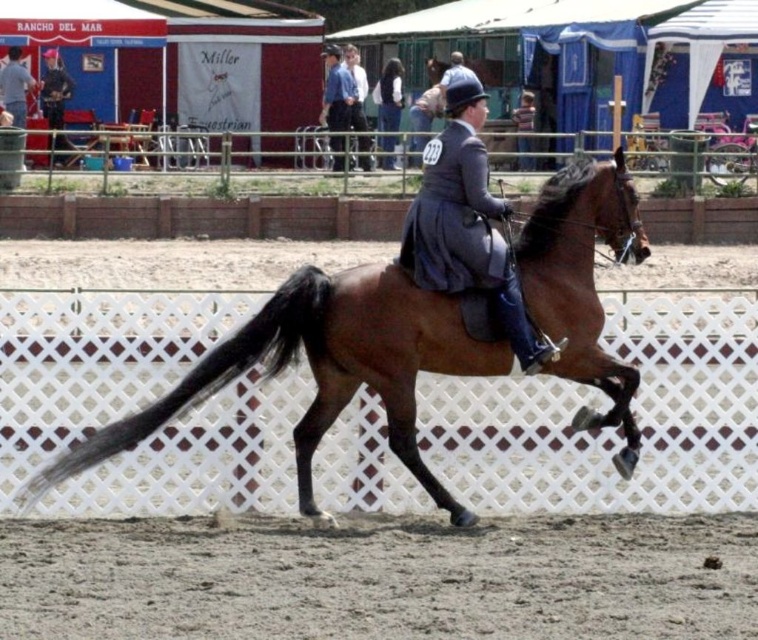
Question: Is matte gray suit at center smaller than blue cotton shirt at upper center?

Choices:
 (A) yes
 (B) no

Answer: (A)

Question: Which point appears closest to the camera in this image?

Choices:
 (A) (381, 124)
 (B) (448, 90)
 (C) (412, 444)

Answer: (C)

Question: Can you confirm if brown sandy dirt at lower center is bigger than brown glossy horse at center?

Choices:
 (A) no
 (B) yes

Answer: (A)

Question: Estimate the real-world distances between objects in this image. Which object is closer to the matte gray suit at center?

Choices:
 (A) brown glossy horse at center
 (B) brown sandy dirt at lower center
 (C) dark blue leather jacket at center
 (D) blue cotton shirt at upper center

Answer: (A)

Question: Which is nearer to the brown sandy dirt at lower center?

Choices:
 (A) matte gray suit at center
 (B) brown glossy horse at center
 (C) dark blue leather jacket at center

Answer: (B)

Question: Can you confirm if brown sandy dirt at lower center is wider than matte gray suit at center?

Choices:
 (A) no
 (B) yes

Answer: (B)